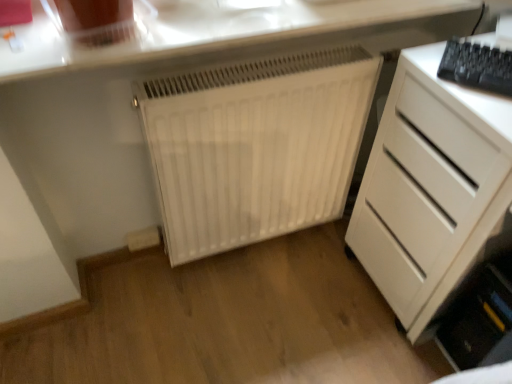
The width and height of the screenshot is (512, 384). Find the location of `free space above white matte radiator at center (from a real-world perspective)`. free space above white matte radiator at center (from a real-world perspective) is located at coordinates (251, 67).